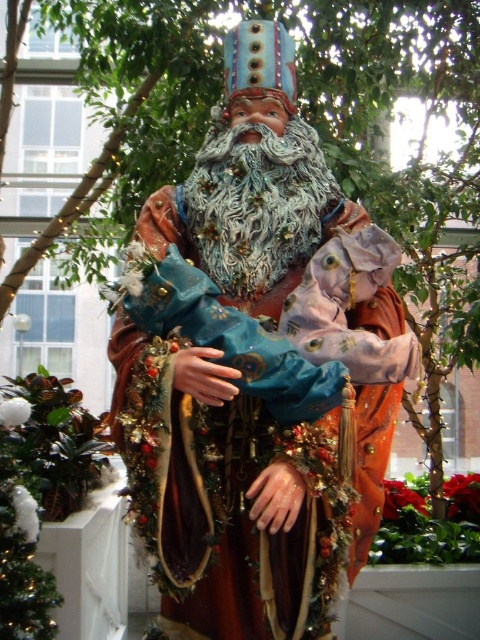
Question: Can you confirm if velvet-like orange robe at center is bigger than fuzzy fabric beard at center?

Choices:
 (A) yes
 (B) no

Answer: (A)

Question: Among these objects, which one is nearest to the camera?

Choices:
 (A) velvet-like orange robe at center
 (B) fuzzy fabric beard at center

Answer: (A)

Question: Does velvet-like orange robe at center appear under fuzzy fabric beard at center?

Choices:
 (A) yes
 (B) no

Answer: (A)

Question: Does velvet-like orange robe at center have a larger size compared to fuzzy fabric beard at center?

Choices:
 (A) no
 (B) yes

Answer: (B)

Question: Which point is closer to the camera?

Choices:
 (A) (308, 438)
 (B) (298, 166)

Answer: (A)